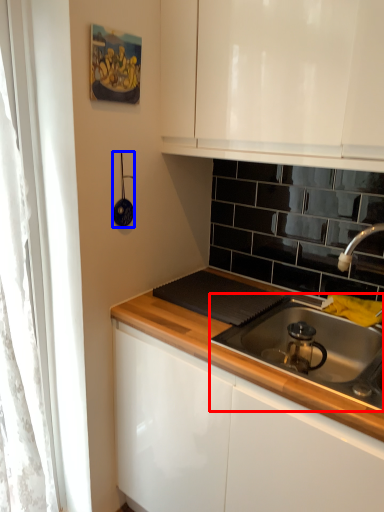
Question: Which of the following is the farthest to the observer, gas stove (highlighted by a red box) or appliance (highlighted by a blue box)?

Choices:
 (A) gas stove
 (B) appliance

Answer: (B)